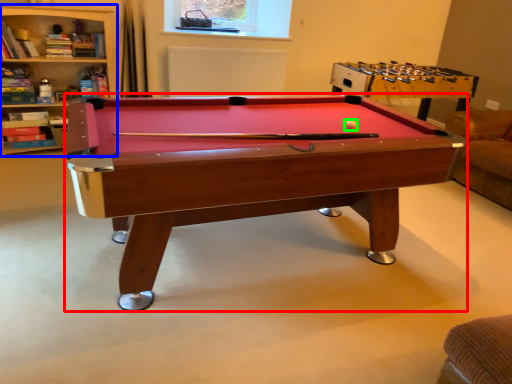
Question: Which object is positioned farthest from billiard table (highlighted by a red box)? Select from bookshelf (highlighted by a blue box) and ball (highlighted by a green box).

Choices:
 (A) bookshelf
 (B) ball

Answer: (A)